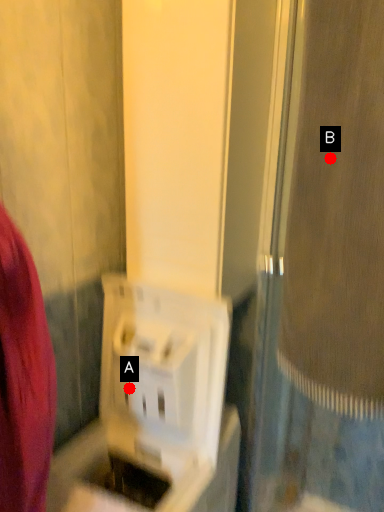
Question: Two points are circled on the image, labeled by A and B beside each circle. Which point appears closest to the camera in this image?

Choices:
 (A) A is closer
 (B) B is closer

Answer: (B)